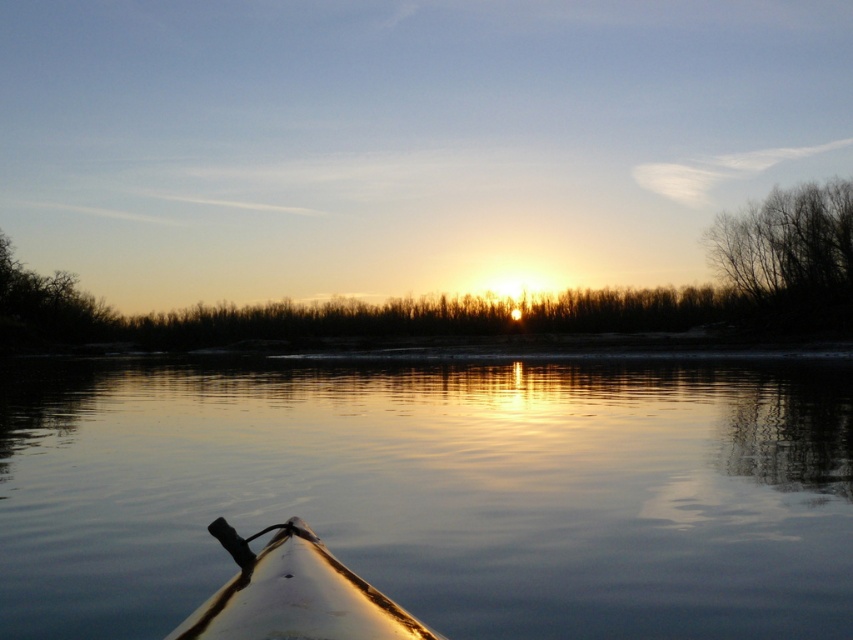
Question: Observing the image, what is the correct spatial positioning of white glossy kayak at lower center in reference to bare branches at upper right?

Choices:
 (A) left
 (B) right

Answer: (A)

Question: Which object is positioned closest to the white glossy kayak at lower center?

Choices:
 (A) bare branches at upper right
 (B) glossy water at center

Answer: (B)

Question: Does white glossy kayak at lower center have a larger size compared to bare branches at upper right?

Choices:
 (A) yes
 (B) no

Answer: (B)

Question: Which point is farther from the camera taking this photo?

Choices:
 (A) (849, 193)
 (B) (370, 632)

Answer: (A)

Question: Is white glossy kayak at lower center above bare branches at upper right?

Choices:
 (A) no
 (B) yes

Answer: (A)

Question: Which point appears closest to the camera in this image?

Choices:
 (A) (231, 550)
 (B) (630, 582)

Answer: (A)